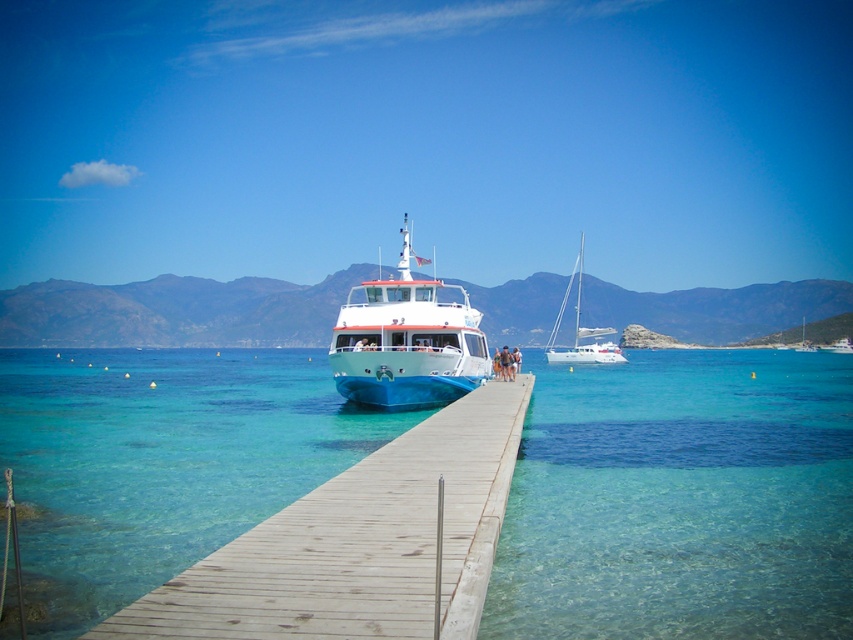
Who is more forward, (x=155, y=637) or (x=614, y=328)?

Positioned in front is point (x=155, y=637).

Is point (434, 422) behind point (578, 353)?

No, it is not.

Between point (248, 632) and point (619, 353), which one is positioned behind?

Positioned behind is point (619, 353).

Locate an element on the screen. wooden at center is located at coordinates (360, 541).

Who is shorter, white glossy cruise ship at center or white glossy sailboat at right?

With less height is white glossy cruise ship at center.

Measure the distance between white glossy cruise ship at center and camera.

white glossy cruise ship at center is 28.50 meters from camera.

Identify the location of white glossy cruise ship at center. The width and height of the screenshot is (853, 640). click(405, 342).

Who is more forward, (450, 532) or (370, 387)?

Point (450, 532)

Which is behind, point (466, 401) or point (364, 310)?

Positioned behind is point (364, 310).

This screenshot has height=640, width=853. Identify the location of wooden at center. (360, 541).